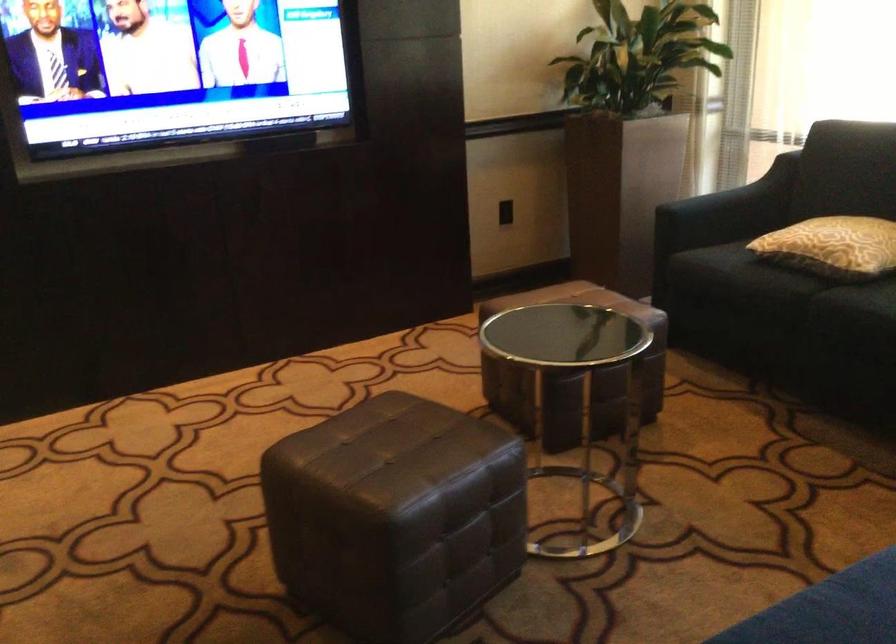
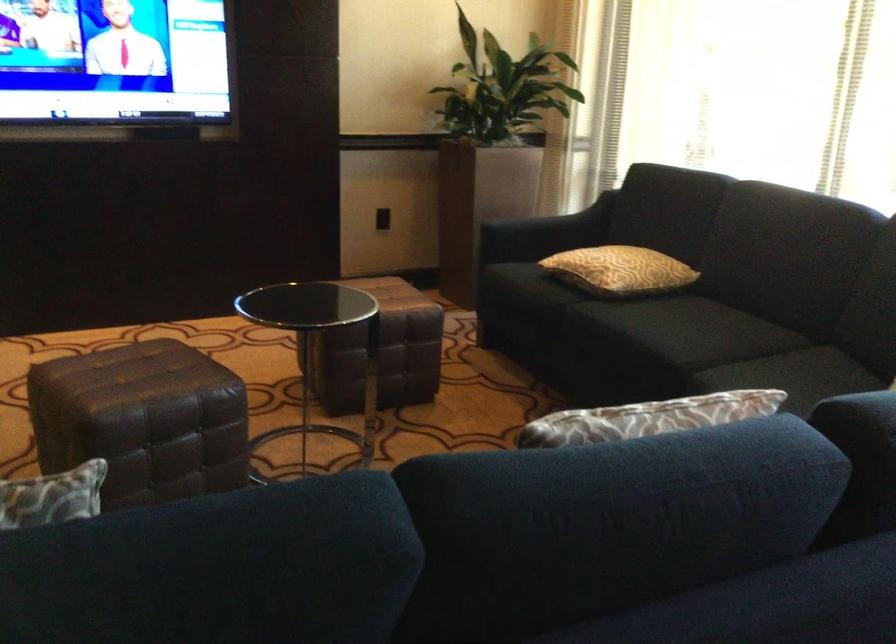
Question: How did the camera likely rotate?

Choices:
 (A) Left
 (B) Right
 (C) Up
 (D) Down

Answer: (C)